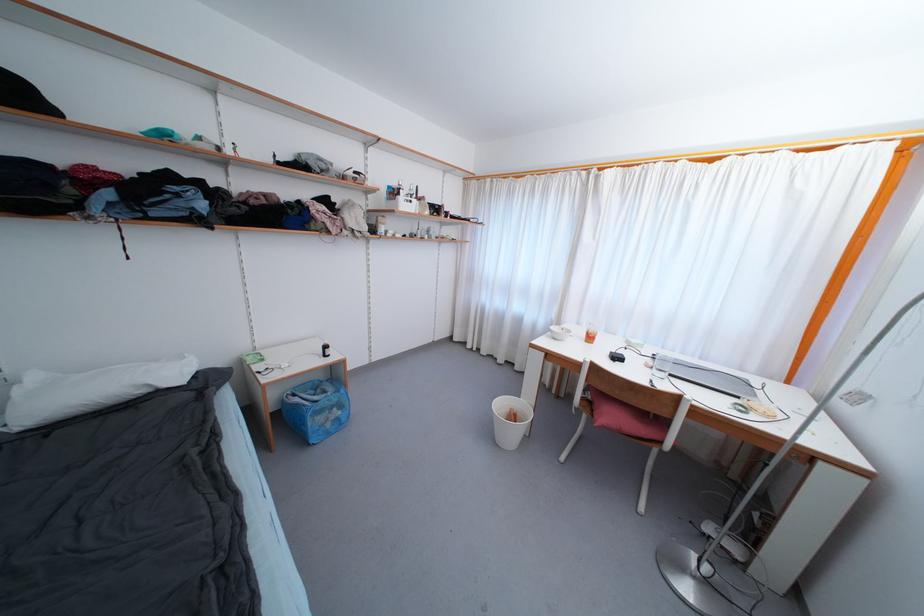
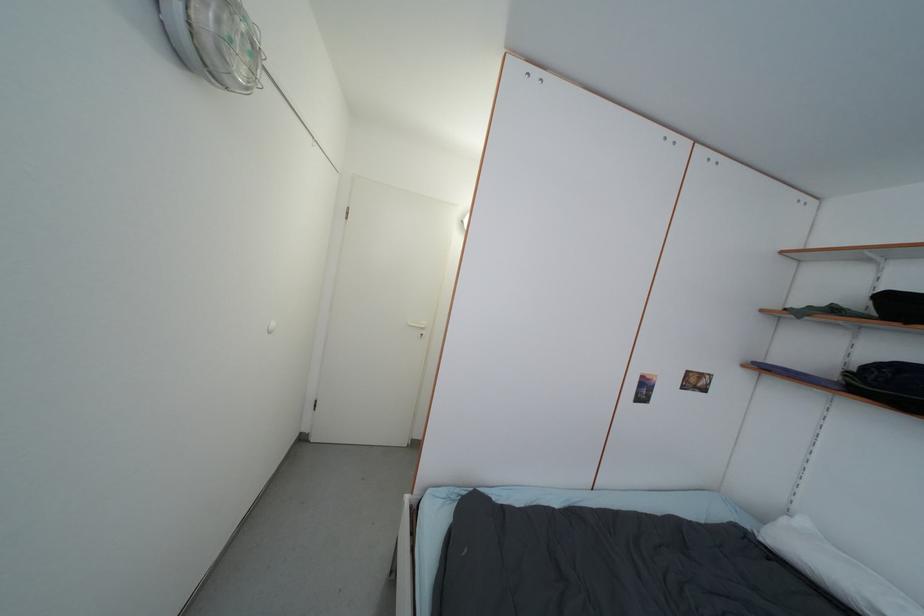
The point at (91, 411) is marked in the first image. Where is the corresponding point in the second image?

(812, 576)